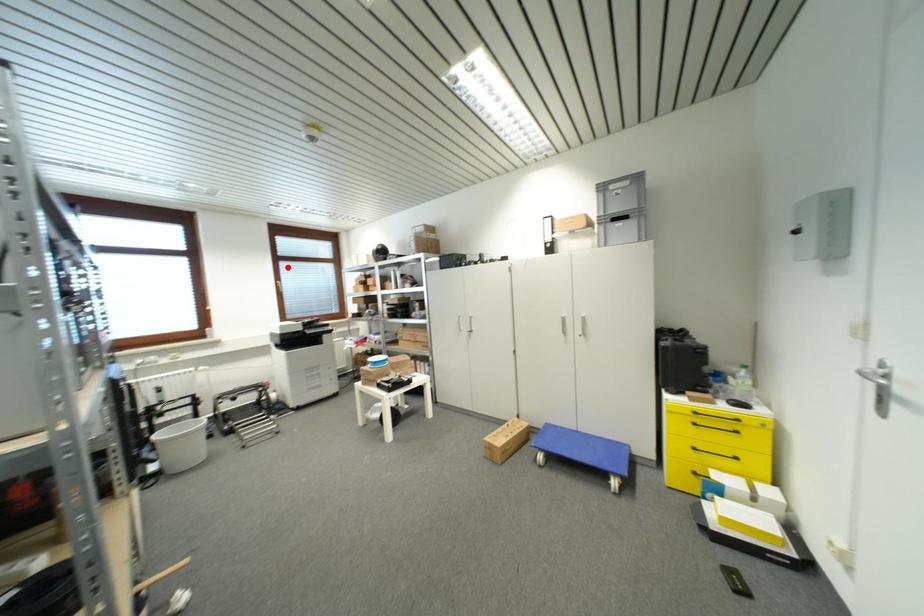
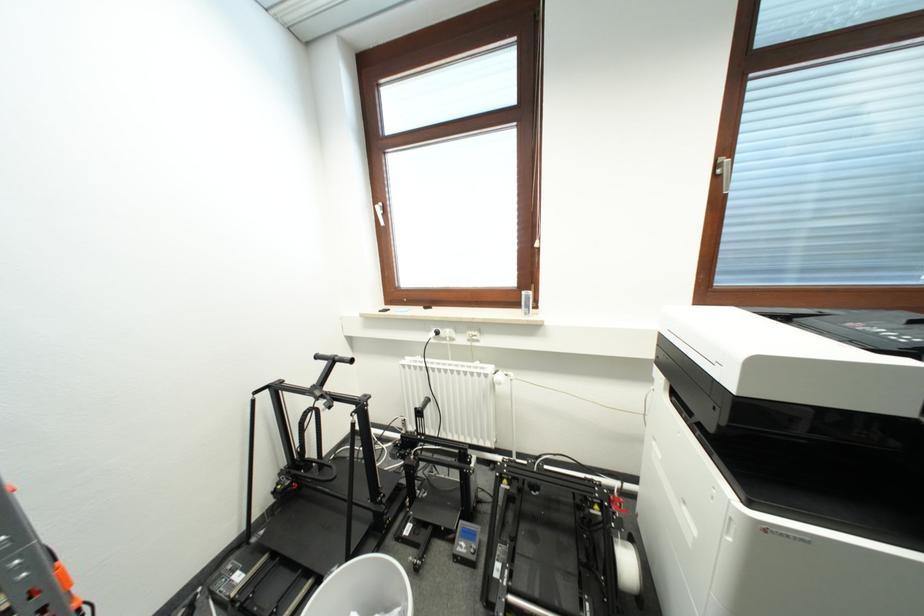
Where in the second image is the point corresponding to the highlighted location from the first image?

(766, 89)